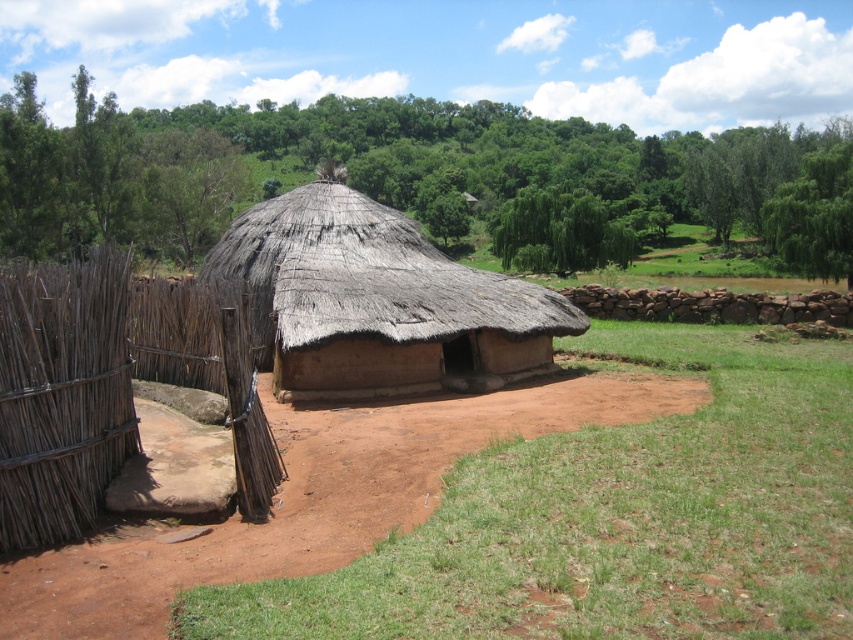
Is point (846, 579) closer to viewer compared to point (523, 348)?

Yes, it is in front of point (523, 348).

Is point (549, 481) positioned after point (465, 298)?

No, it is not.

In the scene shown: Measure the distance between point (469,497) and camera.

Point (469,497) and camera are 6.02 meters apart from each other.

Identify the location of green grass at center. Image resolution: width=853 pixels, height=640 pixels. (614, 518).

Is point (656, 625) closer to camera compared to point (181, 289)?

Yes, point (656, 625) is closer to viewer.

Is green grass at center positioned behind brown woven fence at left?

No, green grass at center is closer to the viewer.

Is point (842, 428) positioned behind point (138, 326)?

No, (842, 428) is in front of (138, 326).

The image size is (853, 640). What are the coordinates of `green grass at center` in the screenshot? It's located at (614, 518).

Does brown woven fence at left have a greater width compared to thatched brown hut at center?

In fact, brown woven fence at left might be narrower than thatched brown hut at center.

The image size is (853, 640). Find the location of `brown woven fence at left`. brown woven fence at left is located at coordinates (108, 387).